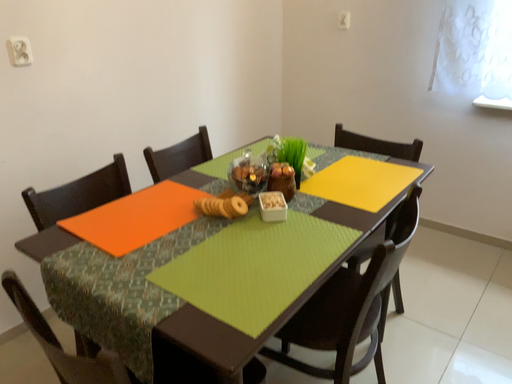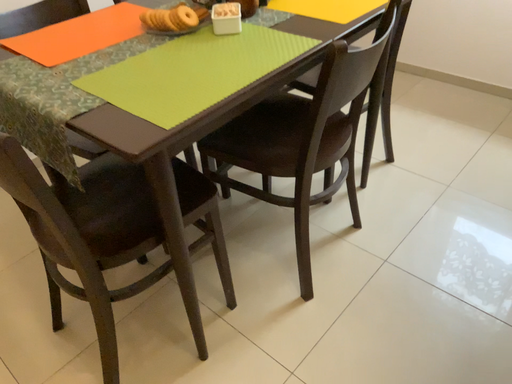
Question: How did the camera likely rotate when shooting the video?

Choices:
 (A) rotated downward
 (B) rotated upward

Answer: (A)